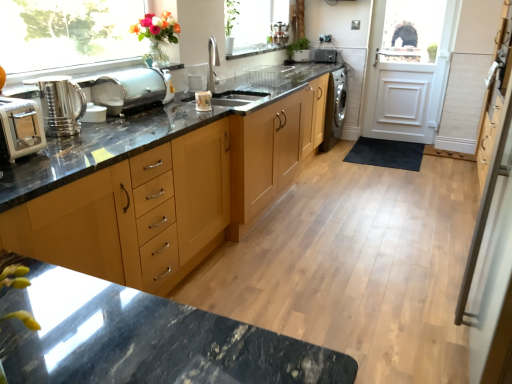
At what (x,y) coordinates should I click in order to perform the action: click on vacant area to the left of silver metallic screen door at right. Please return your answer as a coordinate pair (x, y). This screenshot has width=512, height=384. Looking at the image, I should click on (378, 334).